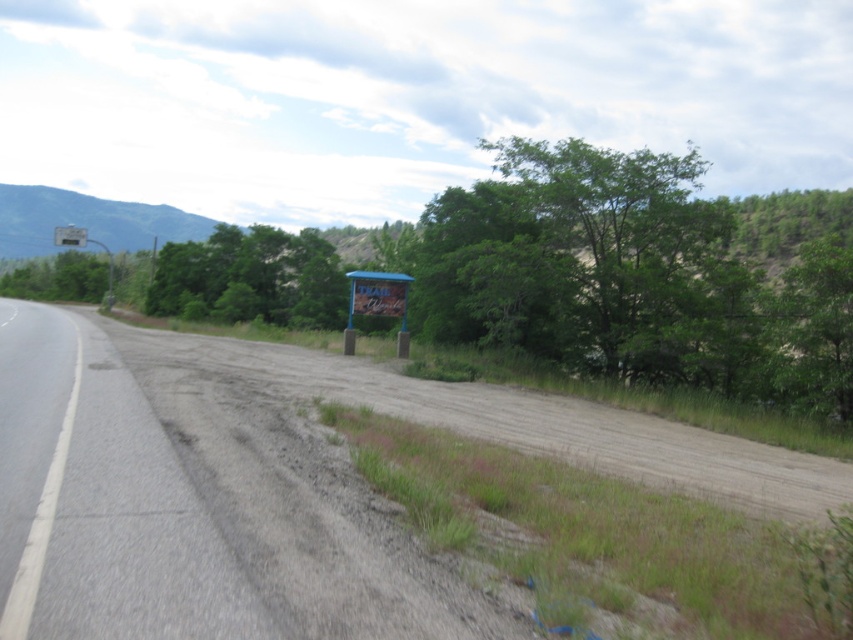
Who is more forward, [9,364] or [402,321]?

Point [9,364] is in front.

Locate an element on the screen. asphalt road at left is located at coordinates (100, 500).

Does point (128, 500) lie behind point (405, 312)?

No, (128, 500) is in front of (405, 312).

You are a GUI agent. You are given a task and a screenshot of the screen. Output one action in this format:
    pyautogui.click(x=<x>, y=<y>)
    Task: Click on the asphalt road at left
    The height and width of the screenshot is (640, 853).
    Given the screenshot: What is the action you would take?
    pyautogui.click(x=100, y=500)

Is blue plastic sign at center further to camera compared to metallic gray sign at upper left?

No, it is not.

Which is more to the left, blue plastic sign at center or metallic gray sign at upper left?

From the viewer's perspective, metallic gray sign at upper left appears more on the left side.

This screenshot has width=853, height=640. In order to click on blue plastic sign at center in this screenshot , I will do `click(376, 304)`.

Does point (62, 228) come closer to viewer compared to point (84, 243)?

No, it is behind (84, 243).

Who is more distant from viewer, (62, 243) or (67, 225)?

Point (67, 225)

The height and width of the screenshot is (640, 853). I want to click on metallic gray sign at upper left, so click(x=83, y=246).